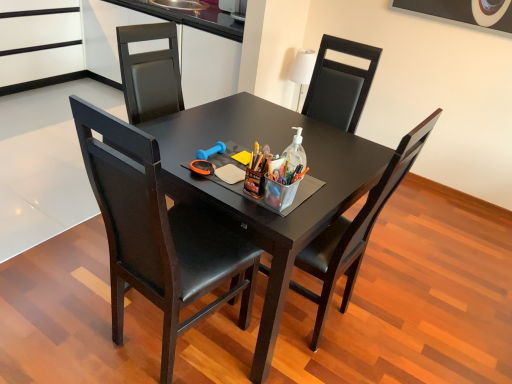
Question: Can you see black glossy table at center touching translucent plastic bottle at center?

Choices:
 (A) yes
 (B) no

Answer: (B)

Question: From a real-world perspective, is black glossy table at center under translucent plastic bottle at center?

Choices:
 (A) no
 (B) yes

Answer: (B)

Question: From the image's perspective, would you say black glossy table at center is shown under translucent plastic bottle at center?

Choices:
 (A) yes
 (B) no

Answer: (A)

Question: Is black glossy table at center positioned with its back to translucent plastic bottle at center?

Choices:
 (A) no
 (B) yes

Answer: (A)

Question: Considering the relative positions of black glossy table at center and translucent plastic bottle at center in the image provided, is black glossy table at center to the left of translucent plastic bottle at center from the viewer's perspective?

Choices:
 (A) yes
 (B) no

Answer: (A)

Question: From a real-world perspective, relative to matte black chair at center, which is counted as the second chair, starting from the right, is black glossy table at center vertically above or below?

Choices:
 (A) below
 (B) above

Answer: (A)

Question: Looking at the image, does black glossy table at center seem bigger or smaller compared to matte black chair at center, the 1th chair positioned from the left?

Choices:
 (A) big
 (B) small

Answer: (A)

Question: Would you say black glossy table at center is to the left or to the right of matte black chair at center, the 1th chair positioned from the left, in the picture?

Choices:
 (A) right
 (B) left

Answer: (A)

Question: From their relative heights in the image, would you say black glossy table at center is taller or shorter than matte black chair at center, which is counted as the second chair, starting from the right?

Choices:
 (A) short
 (B) tall

Answer: (A)

Question: From a real-world perspective, relative to translucent plastic bottle at center, is matte black chair at center, the 1th chair positioned from the left, vertically above or below?

Choices:
 (A) above
 (B) below

Answer: (B)

Question: In terms of width, does matte black chair at center, the 1th chair positioned from the left, look wider or thinner when compared to translucent plastic bottle at center?

Choices:
 (A) wide
 (B) thin

Answer: (A)

Question: Considering the positions of matte black chair at center, which is counted as the second chair, starting from the right, and translucent plastic bottle at center in the image, is matte black chair at center, which is counted as the second chair, starting from the right, taller or shorter than translucent plastic bottle at center?

Choices:
 (A) tall
 (B) short

Answer: (A)

Question: Based on their sizes in the image, would you say matte black chair at center, which is counted as the second chair, starting from the right, is bigger or smaller than translucent plastic bottle at center?

Choices:
 (A) big
 (B) small

Answer: (A)

Question: In terms of size, does translucent plastic bottle at center appear bigger or smaller than matte black chair at center, which is counted as the second chair, starting from the right?

Choices:
 (A) small
 (B) big

Answer: (A)

Question: Relative to matte black chair at center, which is counted as the second chair, starting from the right, is translucent plastic bottle at center in front or behind?

Choices:
 (A) behind
 (B) front

Answer: (A)